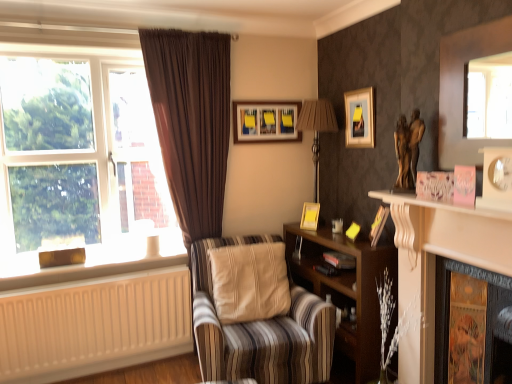
Question: From the image's perspective, is wooden shelf at center under gold textured fireplace at lower right, the first fireplace in the right-to-left sequence?

Choices:
 (A) no
 (B) yes

Answer: (B)

Question: Does wooden shelf at center have a larger size compared to gold textured fireplace at lower right, the first fireplace in the right-to-left sequence?

Choices:
 (A) no
 (B) yes

Answer: (B)

Question: Is gold textured fireplace at lower right, the first fireplace in the right-to-left sequence, surrounded by wooden shelf at center?

Choices:
 (A) yes
 (B) no

Answer: (B)

Question: From a real-world perspective, is wooden shelf at center located beneath gold textured fireplace at lower right, which ranks as the second fireplace in left-to-right order?

Choices:
 (A) yes
 (B) no

Answer: (A)

Question: Is wooden shelf at center far away from gold textured fireplace at lower right, which ranks as the second fireplace in left-to-right order?

Choices:
 (A) no
 (B) yes

Answer: (A)

Question: Can you see wooden shelf at center touching gold textured fireplace at lower right, the first fireplace in the right-to-left sequence?

Choices:
 (A) yes
 (B) no

Answer: (B)

Question: Are beige painted wood at lower left and matte yellow picture frame at upper right, placed as the 3th picture frame when sorted from back to front, far apart?

Choices:
 (A) no
 (B) yes

Answer: (B)

Question: From a real-world perspective, is beige painted wood at lower left beneath matte yellow picture frame at upper right, placed as the 3th picture frame when sorted from back to front?

Choices:
 (A) yes
 (B) no

Answer: (A)

Question: Is beige painted wood at lower left positioned before matte yellow picture frame at upper right, the second picture frame in the top-to-bottom sequence?

Choices:
 (A) no
 (B) yes

Answer: (B)

Question: Is beige painted wood at lower left to the right of matte yellow picture frame at upper right, the second picture frame in the top-to-bottom sequence, from the viewer's perspective?

Choices:
 (A) yes
 (B) no

Answer: (B)

Question: From the image's perspective, does beige painted wood at lower left appear lower than matte yellow picture frame at upper right, the second picture frame when ordered from front to back?

Choices:
 (A) yes
 (B) no

Answer: (A)

Question: Is beige painted wood at lower left not inside matte yellow picture frame at upper right, the 3th picture frame positioned from the left?

Choices:
 (A) no
 (B) yes

Answer: (B)

Question: Is wooden picture frame at center, the third picture frame from the right, far away from matte yellow picture frame at upper right, placed as the 2th picture frame when sorted from right to left?

Choices:
 (A) no
 (B) yes

Answer: (A)